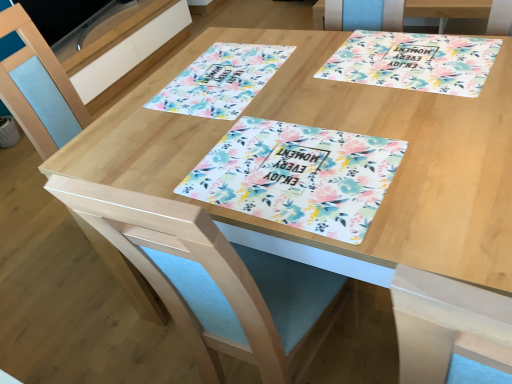
Identify the location of unoccupied region to the right of floral paper placemat at upper center, marked as the 1th flyer in a top-to-bottom arrangement. This screenshot has width=512, height=384. pyautogui.click(x=332, y=62).